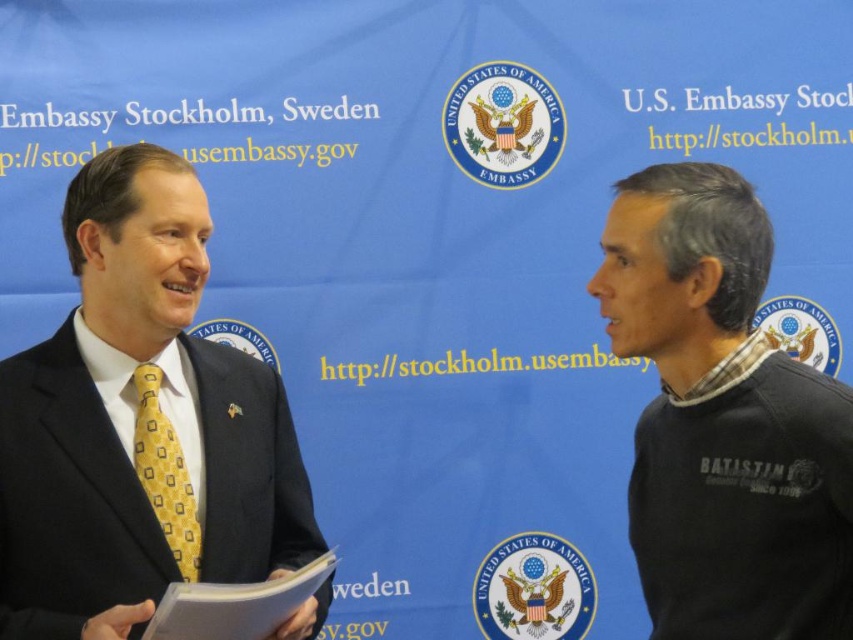
Where is the matte black suit at left located in the image?

The matte black suit at left is located at point (138, 424).

You are an observer at the U.S. Embassy event. You notice two items on the attendees. The dark gray sweater at right and the yellow silk tie at left. Which item is covering part of the other?

The dark gray sweater at right is positioned over the yellow silk tie at left, so it is covering part of it.